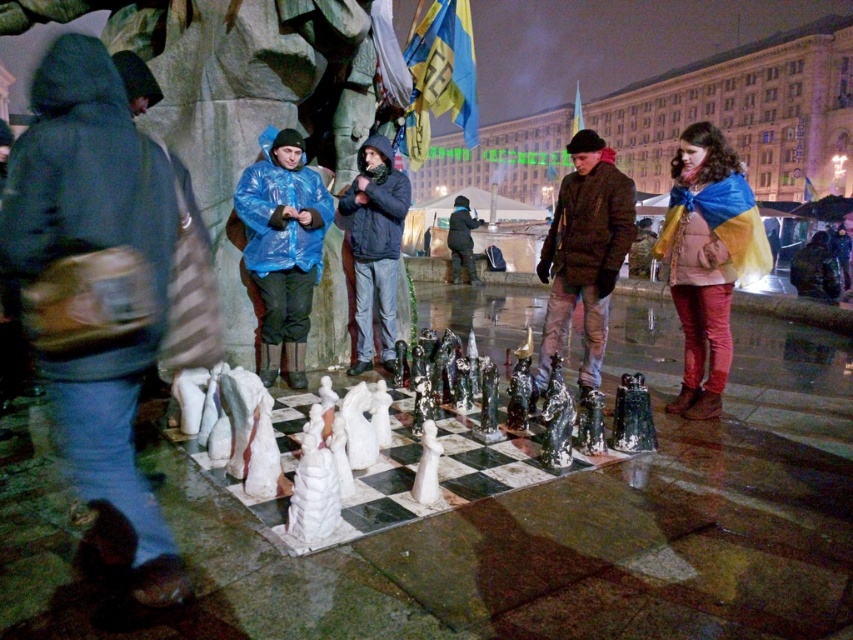
Does dark blue hooded jacket at center have a larger size compared to blue and yellow fabric draped at center?

Indeed, dark blue hooded jacket at center has a larger size compared to blue and yellow fabric draped at center.

Is point (119, 157) positioned behind point (706, 332)?

No, it is in front of (706, 332).

What do you see at coordinates (86, 252) in the screenshot? I see `dark blue hooded jacket at center` at bounding box center [86, 252].

Locate an element on the screen. The width and height of the screenshot is (853, 640). dark blue hooded jacket at center is located at coordinates (86, 252).

Is point (689, 168) positioned before point (369, 243)?

Yes, it is.

What are the coordinates of `blue and yellow fabric draped at center` in the screenshot? It's located at (706, 259).

Can you confirm if brown textured jacket at center is thinner than matte blue raincoat at center?

Yes.

Who is positioned more to the right, brown textured jacket at center or matte blue raincoat at center?

From the viewer's perspective, brown textured jacket at center appears more on the right side.

Who is more forward, (x=598, y=218) or (x=463, y=243)?

Point (x=598, y=218) is more forward.

The height and width of the screenshot is (640, 853). I want to click on brown textured jacket at center, so click(x=584, y=252).